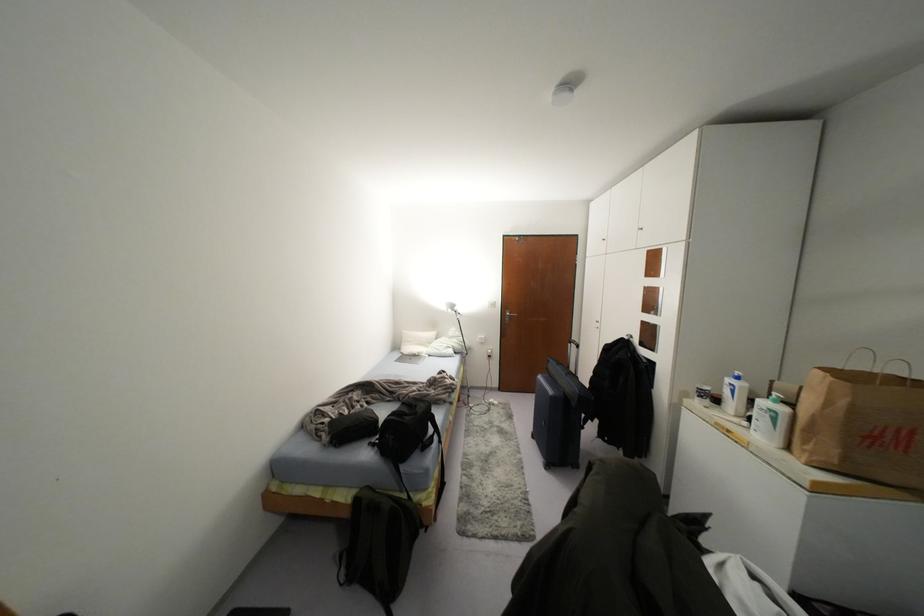
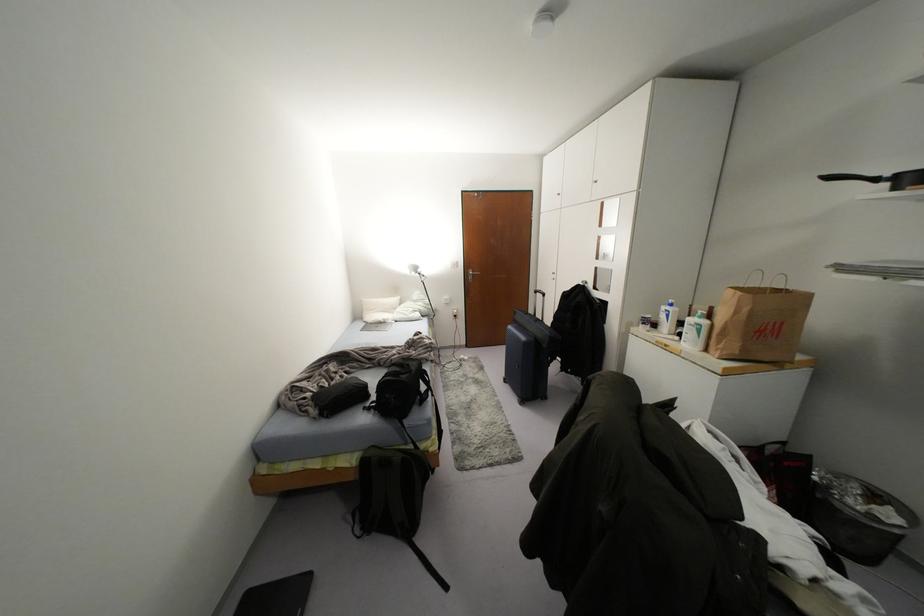
In the second image, find the point that corresponds to point (431, 334) in the first image.

(394, 299)